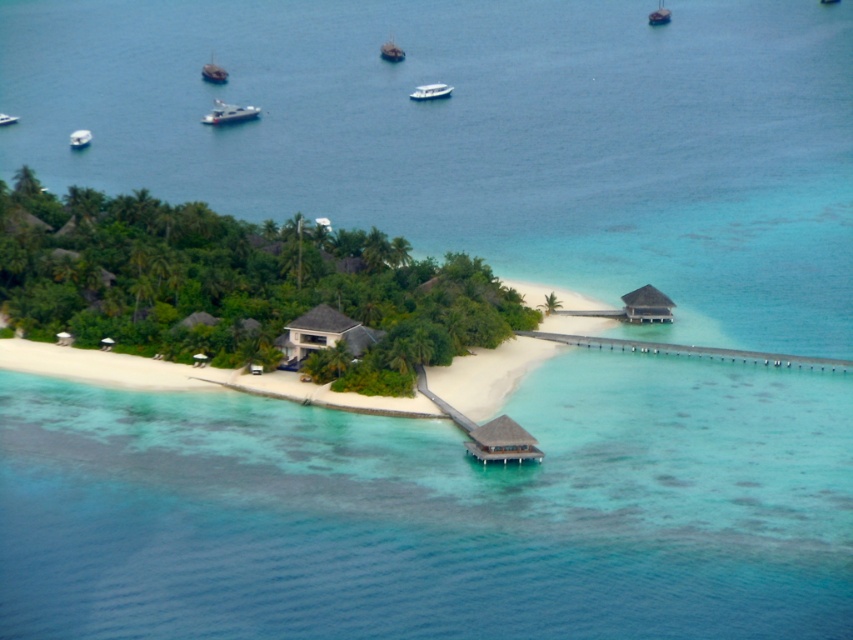
Does white glossy boat at center have a lesser height compared to metallic silver boat at upper left?

Correct, white glossy boat at center is not as tall as metallic silver boat at upper left.

Which is below, white glossy boat at center or metallic silver boat at upper left?

metallic silver boat at upper left is below.

Find the location of a particular element. This screenshot has width=853, height=640. white glossy boat at center is located at coordinates (430, 92).

Identify the location of white glossy boat at center. Image resolution: width=853 pixels, height=640 pixels. click(x=430, y=92).

Does white glossy boat at center appear over metallic silver boat at upper right?

Actually, white glossy boat at center is below metallic silver boat at upper right.

Is white glossy boat at center below metallic silver boat at upper right?

Yes.

This screenshot has height=640, width=853. I want to click on white glossy boat at center, so click(x=430, y=92).

Does white glossy boat at upper center lie in front of metallic silver boat at upper left?

No, it is behind metallic silver boat at upper left.

The width and height of the screenshot is (853, 640). What are the coordinates of `white glossy boat at upper center` in the screenshot? It's located at (229, 113).